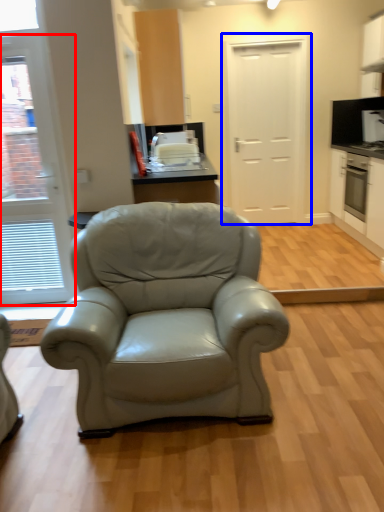
Question: Which of the following is the farthest to the observer, door (highlighted by a red box) or door (highlighted by a blue box)?

Choices:
 (A) door
 (B) door

Answer: (B)